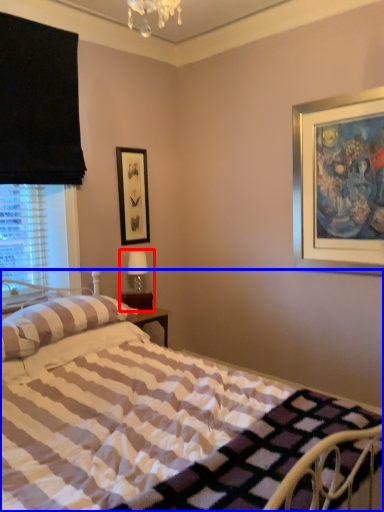
Question: Which object is closer to the camera taking this photo, table lamp (highlighted by a red box) or bed (highlighted by a blue box)?

Choices:
 (A) table lamp
 (B) bed

Answer: (B)